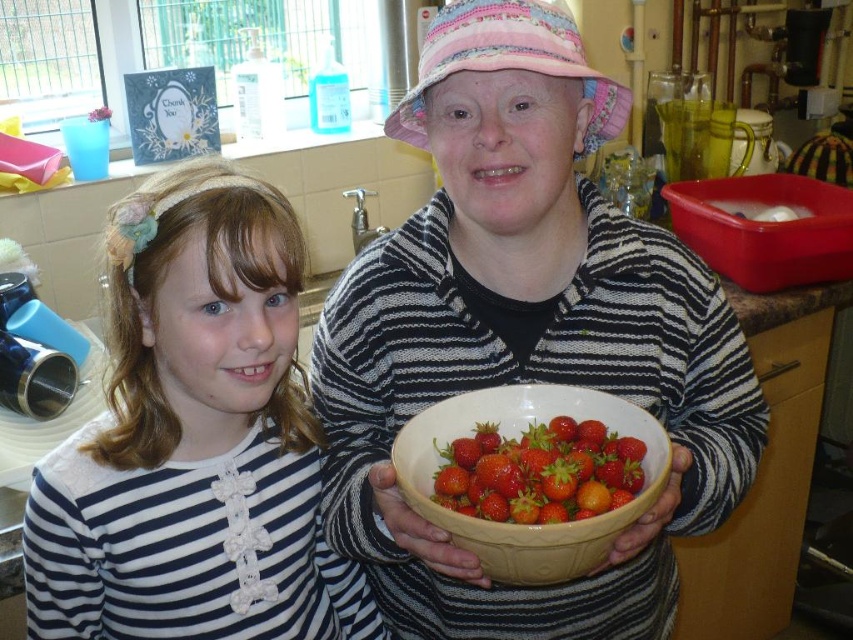
Between matte ceramic bowl at center and white ceramic bowl at center, which one is positioned lower?

white ceramic bowl at center

Is matte ceramic bowl at center shorter than white ceramic bowl at center?

In fact, matte ceramic bowl at center may be taller than white ceramic bowl at center.

Find the location of `matte ceramic bowl at center`. matte ceramic bowl at center is located at coordinates (524, 332).

Is white striped shirt at center smaller than glossy red strawberries at center?

No, white striped shirt at center is not smaller than glossy red strawberries at center.

Consider the image. Which of these two, white striped shirt at center or glossy red strawberries at center, stands shorter?

glossy red strawberries at center

Describe the element at coordinates (194, 440) in the screenshot. I see `white striped shirt at center` at that location.

Where is `white striped shirt at center`? The image size is (853, 640). white striped shirt at center is located at coordinates (194, 440).

Is white ceramic bowl at center to the left of glossy red strawberries at center from the viewer's perspective?

Correct, you'll find white ceramic bowl at center to the left of glossy red strawberries at center.

Who is taller, white ceramic bowl at center or glossy red strawberries at center?

With more height is white ceramic bowl at center.

Measure the distance between white ceramic bowl at center and camera.

They are 23.71 inches apart.

Find the location of a particular element. Image resolution: width=853 pixels, height=640 pixels. white ceramic bowl at center is located at coordinates (517, 438).